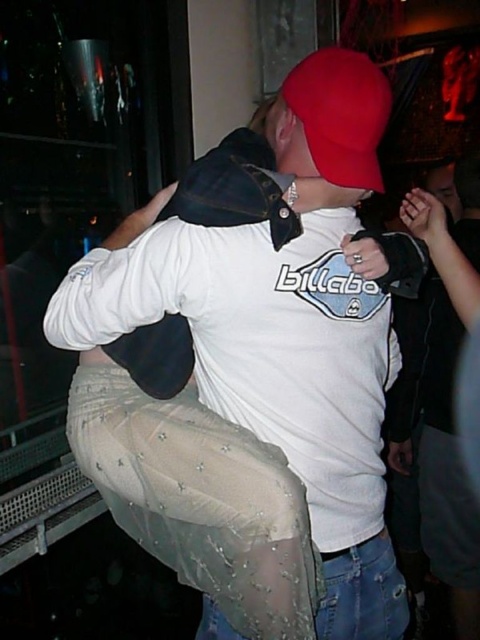
Which of these two, white matte shirt at center or red matte baseball hat at upper center, stands taller?

Standing taller between the two is white matte shirt at center.

Is the position of white matte shirt at center more distant than that of red matte baseball hat at upper center?

Yes, white matte shirt at center is behind red matte baseball hat at upper center.

Is point (280, 493) closer to viewer compared to point (321, 83)?

No, it is not.

Locate an element on the screen. white matte shirt at center is located at coordinates pyautogui.click(x=248, y=356).